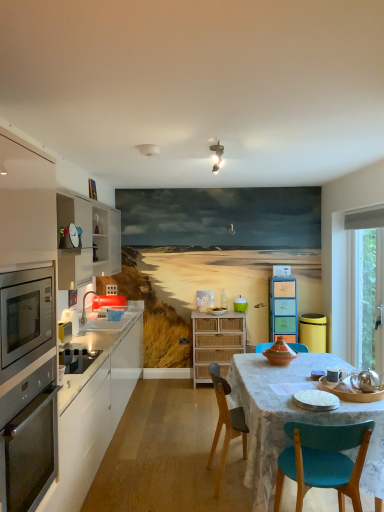
Image resolution: width=384 pixels, height=512 pixels. What are the coordinates of `free space to the left of wooden chair at center` in the screenshot? It's located at (180, 489).